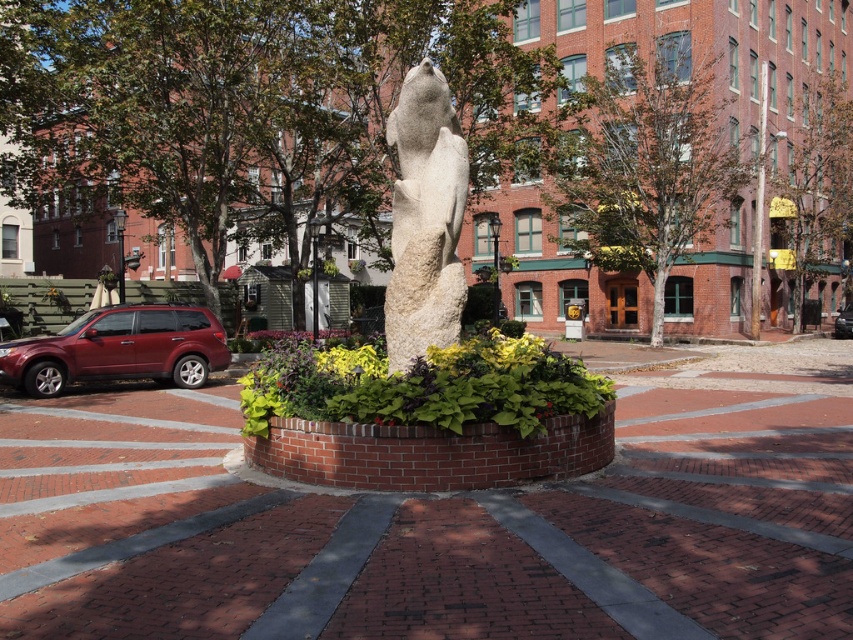
Measure the distance between white stone statue at center and camera.

white stone statue at center and camera are 7.32 meters apart.

Can you confirm if white stone statue at center is wider than matte red suv at left?

No.

This screenshot has width=853, height=640. I want to click on white stone statue at center, so click(x=425, y=218).

Between matte red suv at left and metallic silver sedan at center, which one appears on the right side from the viewer's perspective?

Positioned to the right is metallic silver sedan at center.

At what (x,y) coordinates should I click in order to perform the action: click on matte red suv at left. Please return your answer as a coordinate pair (x, y). This screenshot has width=853, height=640. Looking at the image, I should click on (119, 348).

Does point (430, 180) come in front of point (834, 326)?

That is True.

Measure the distance between point [450,282] and camera.

The distance of point [450,282] from camera is 7.59 meters.

I want to click on white stone statue at center, so click(x=425, y=218).